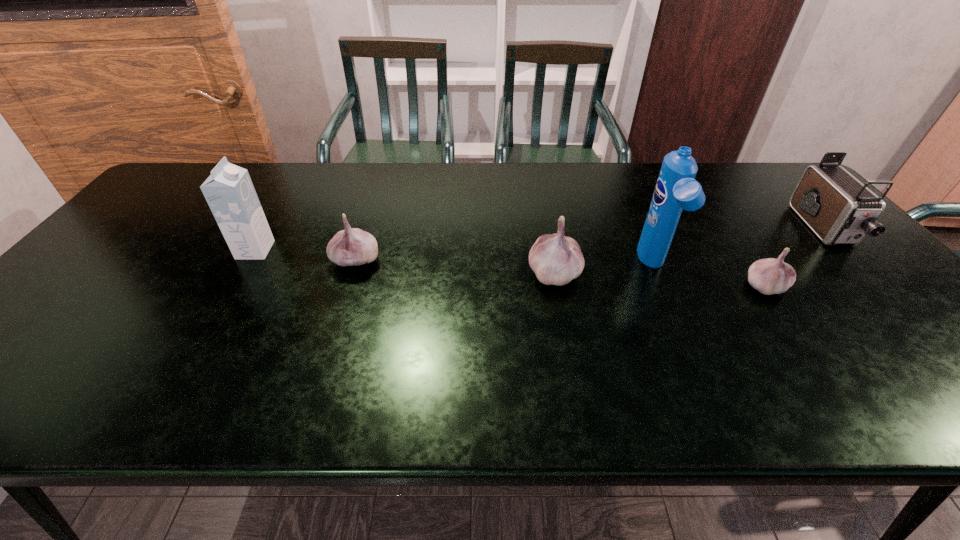
This screenshot has height=540, width=960. Identify the location of free space that satisfies the following two spatial constraints: 1. on the front label of the fifth shortest object; 2. on the right side of the shortest garlic. (234, 286).

What are the coordinates of `free space that satisfies the following two spatial constraints: 1. on the front label of the leftmost object; 2. on the back side of the third object from right to left` in the screenshot? It's located at (246, 267).

Where is `blank area in the image that satisfies the following two spatial constraints: 1. at the lens of the rightmost object; 2. on the front label of the leftmost object`? blank area in the image that satisfies the following two spatial constraints: 1. at the lens of the rightmost object; 2. on the front label of the leftmost object is located at coordinates (844, 250).